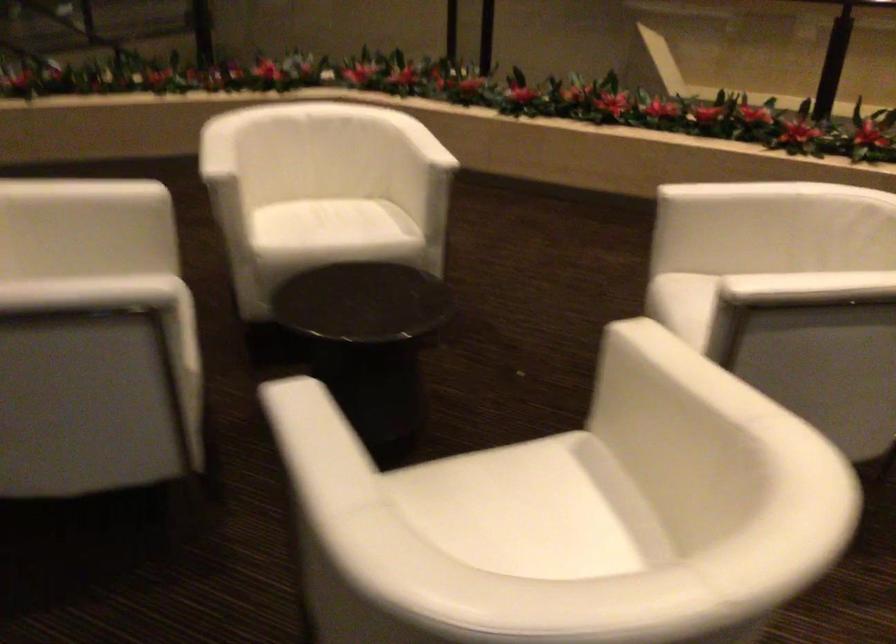
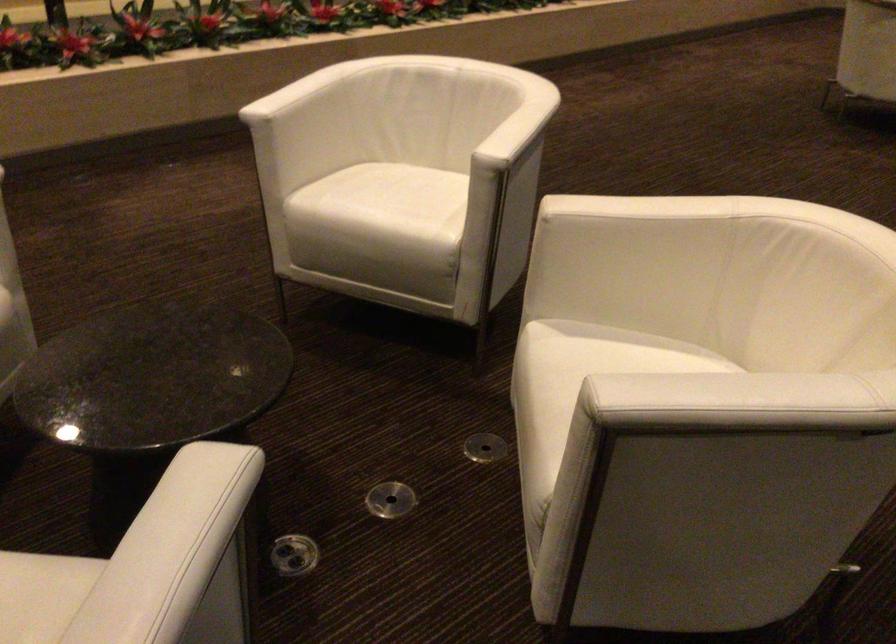
Find the pixel in the second image that matches the point at 89,295 in the first image.

(186, 527)